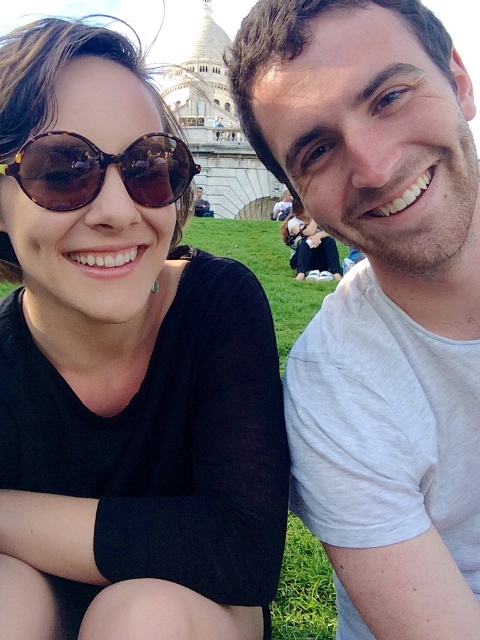
Question: Does tortoiseshell sunglasses at upper left appear under stone tower at upper center?

Choices:
 (A) no
 (B) yes

Answer: (B)

Question: Which of the following is the closest to the observer?

Choices:
 (A) [x=196, y=125]
 (B) [x=132, y=304]
 (C) [x=87, y=141]
 (D) [x=321, y=182]

Answer: (C)

Question: Which of the following is the closest to the observer?

Choices:
 (A) (101, 227)
 (B) (211, 125)
 (C) (437, 452)

Answer: (A)

Question: Which object appears closest to the camera in this image?

Choices:
 (A) stone tower at upper center
 (B) white cotton t-shirt at center
 (C) brown tortoiseshell sunglasses at left
 (D) tortoiseshell sunglasses at upper left

Answer: (D)

Question: Observing the image, what is the correct spatial positioning of brown tortoiseshell sunglasses at left in reference to stone tower at upper center?

Choices:
 (A) above
 (B) below

Answer: (B)

Question: Does tortoiseshell sunglasses at upper left have a smaller size compared to white cotton t-shirt at center?

Choices:
 (A) no
 (B) yes

Answer: (A)